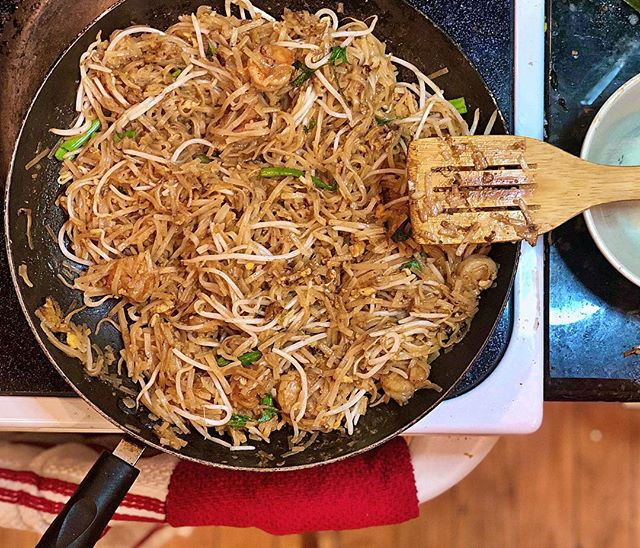
What are the coordinates of `red and white dish towel` in the screenshot? It's located at (58, 477).